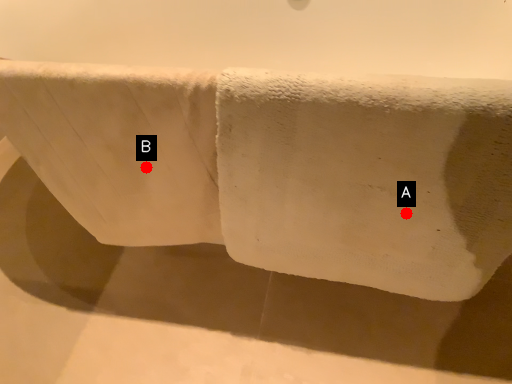
Question: Two points are circled on the image, labeled by A and B beside each circle. Which point appears farthest from the camera in this image?

Choices:
 (A) A is further
 (B) B is further

Answer: (B)